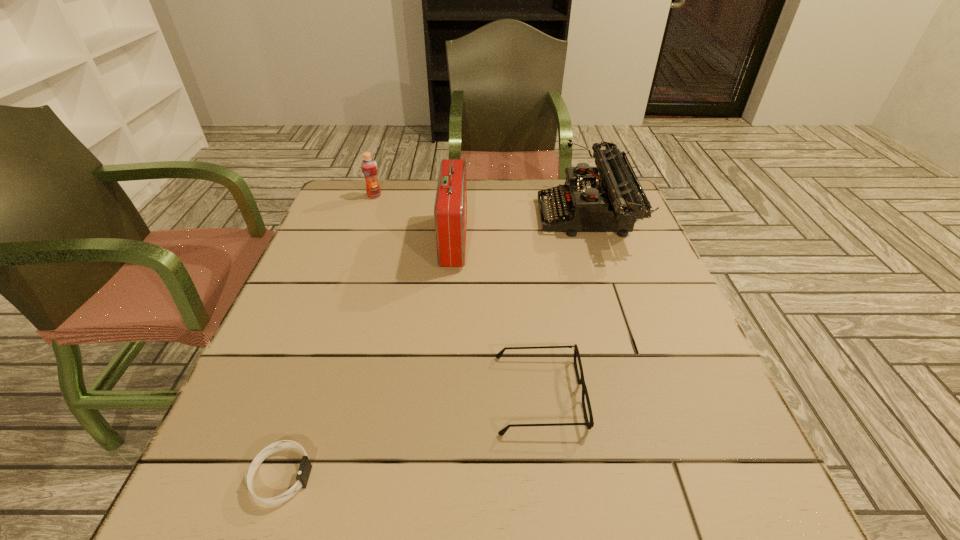
Identify which object is the third nearest to the spectacles. Please provide its 2D coordinates. Your answer should be formatted as a tuple, i.e. [(x, y)], where the tuple contains the x and y coordinates of a point satisfying the conditions above.

[(612, 202)]